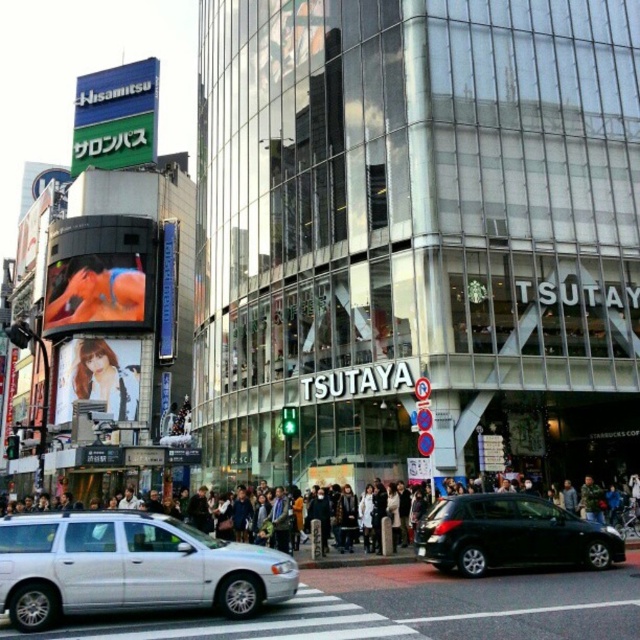
Who is taller, silver metallic station wagon at center or dark gray concrete crowd at center?

dark gray concrete crowd at center

Between point (177, 604) and point (627, 541), which one is positioned behind?

Positioned behind is point (627, 541).

Identify the location of silver metallic station wagon at center. The width and height of the screenshot is (640, 640). (129, 566).

I want to click on silver metallic station wagon at center, so click(129, 566).

Is matte plastic billboard at center closer to the viewer compared to dark gray concrete crowd at center?

No, it is not.

Between matte plastic billboard at center and dark gray concrete crowd at center, which one is positioned higher?

Positioned higher is matte plastic billboard at center.

Which is in front, point (116, 365) or point (397, 561)?

Point (397, 561) is in front.

This screenshot has height=640, width=640. What are the coordinates of `matte plastic billboard at center` in the screenshot? It's located at (99, 376).

Between green signboard at upper left and camouflage jacket at center, which one is positioned higher?

green signboard at upper left is above.

Is point (120, 164) farther from camera compared to point (588, 476)?

Yes, point (120, 164) is farther from viewer.

Measure the distance between green signboard at upper left and camera.

319.03 feet

The image size is (640, 640). I want to click on green signboard at upper left, so click(x=115, y=116).